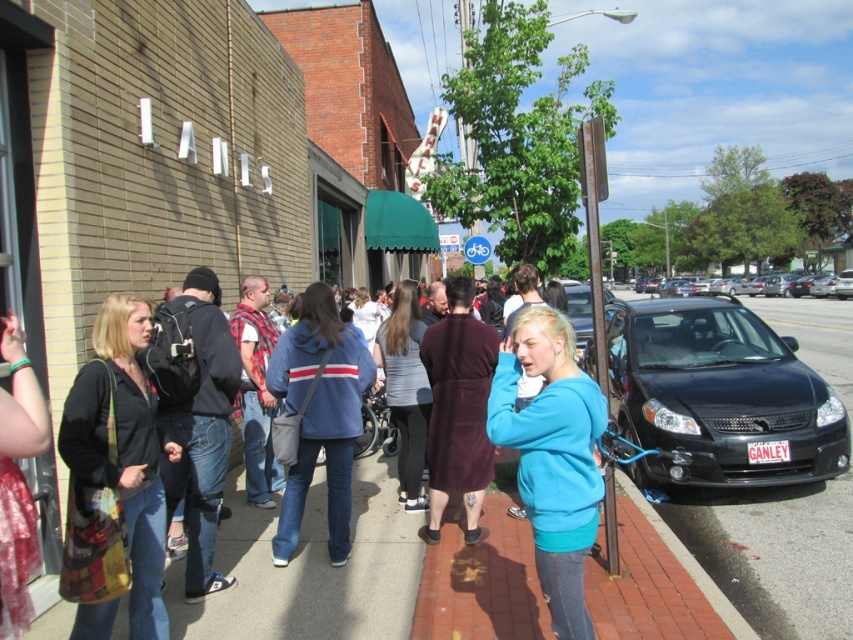
Is black matte hatchback at right positioned before blue fleece jacket at center?

No, black matte hatchback at right is further to the viewer.

In the scene shown: Who is taller, black matte hatchback at right or blue fleece jacket at center?

Standing taller between the two is black matte hatchback at right.

At what (x,y) coordinates should I click in order to perform the action: click on black matte hatchback at right. Please return your answer as a coordinate pair (x, y). Looking at the image, I should click on (718, 396).

At what (x,y) coordinates should I click in order to perform the action: click on black matte hatchback at right. Please return your answer as a coordinate pair (x, y). This screenshot has width=853, height=640. Looking at the image, I should click on (718, 396).

Between point (325, 451) and point (775, 282), which one is positioned behind?

The point (775, 282) is more distant.

Between blue cotton hoodie at center and black glossy sedan at center, which one has more height?

Standing taller between the two is black glossy sedan at center.

What do you see at coordinates (318, 416) in the screenshot? I see `blue cotton hoodie at center` at bounding box center [318, 416].

At what (x,y) coordinates should I click in order to perform the action: click on blue cotton hoodie at center. Please return your answer as a coordinate pair (x, y). Image resolution: width=853 pixels, height=640 pixels. Looking at the image, I should click on (318, 416).

Does black matte hatchback at right appear on the left side of blue cotton hoodie at center?

In fact, black matte hatchback at right is to the right of blue cotton hoodie at center.

Which is below, black matte hatchback at right or blue cotton hoodie at center?

blue cotton hoodie at center is below.

At what (x,y) coordinates should I click in order to perform the action: click on black matte hatchback at right. Please return your answer as a coordinate pair (x, y). Looking at the image, I should click on (718, 396).